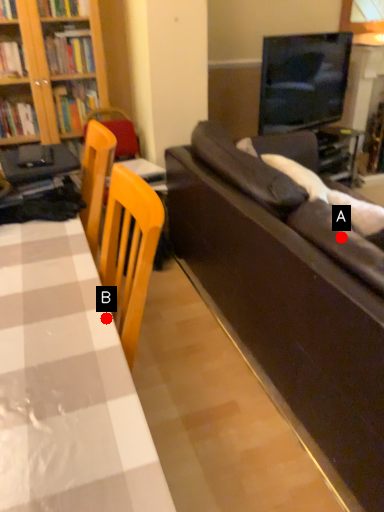
Question: Two points are circled on the image, labeled by A and B beside each circle. Which point is closer to the camera?

Choices:
 (A) A is closer
 (B) B is closer

Answer: (B)